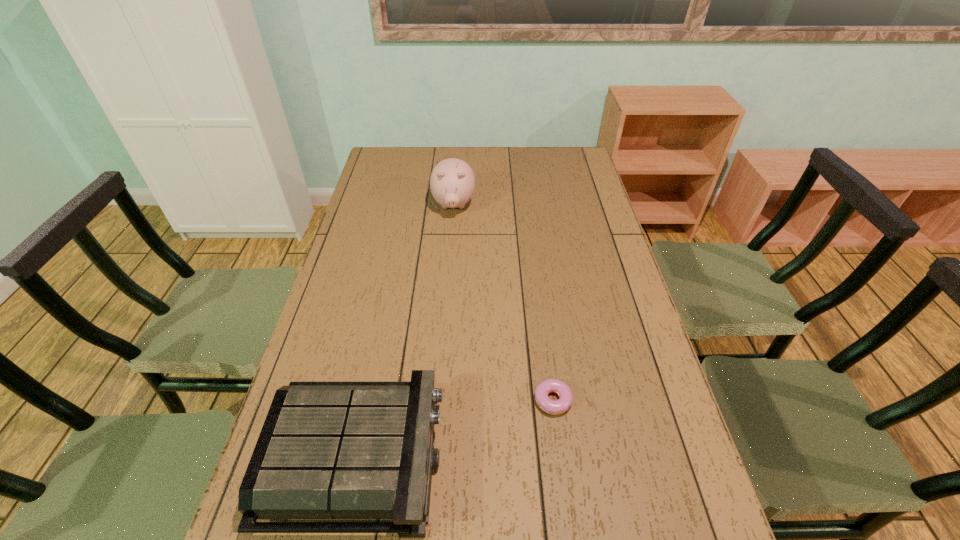
Find the location of a particular element. This screenshot has width=960, height=540. blank region between the piggy bank and the shortest object is located at coordinates point(503,302).

What are the coordinates of `vacant space in between the doughnut and the farthest object` in the screenshot? It's located at click(x=503, y=302).

The image size is (960, 540). What are the coordinates of `vacant space that's between the farthest object and the doughnut` in the screenshot? It's located at (503, 302).

I want to click on vacant area that lies between the tallest object and the shortest object, so click(x=503, y=302).

Identify the location of object that is the second closest one to the piggy bank. This screenshot has width=960, height=540. (327, 450).

Find the location of a particular element. object that is the nearest to the doughnut is located at coordinates (327, 450).

Identify the location of free region that satisfies the following two spatial constraints: 1. at the snout of the rightmost object; 2. on the left side of the farthest object. (439, 399).